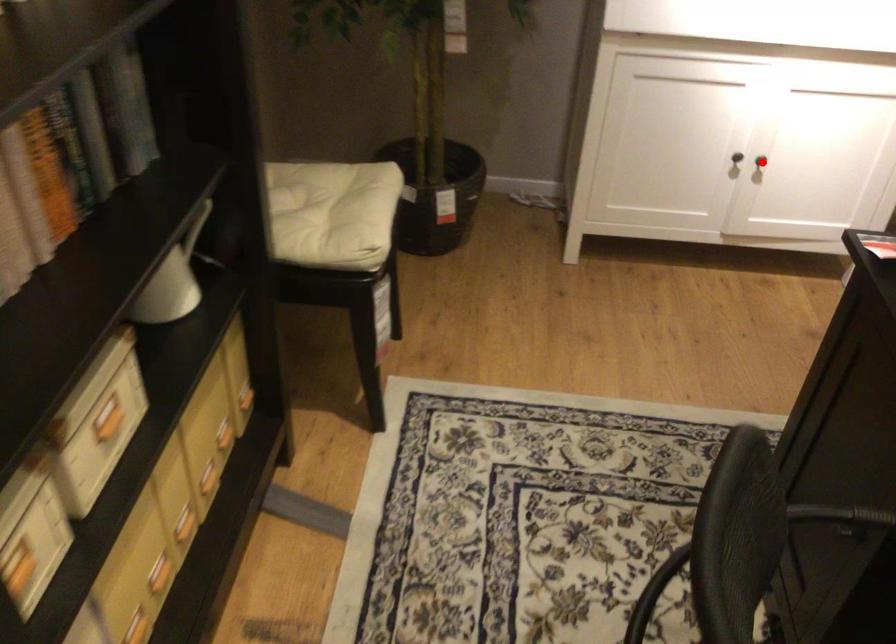
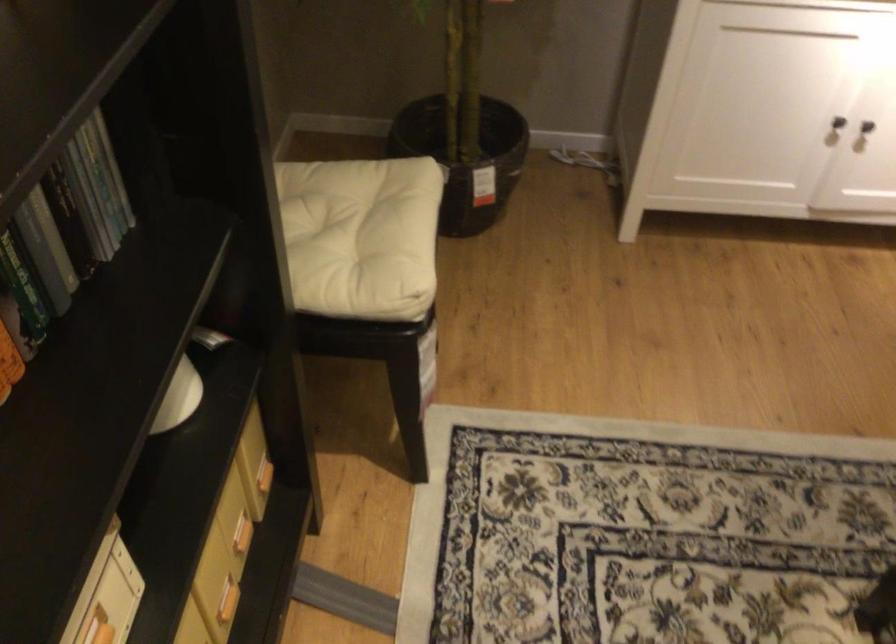
The point at the highlighted location is marked in the first image. Where is the corresponding point in the second image?

(866, 126)